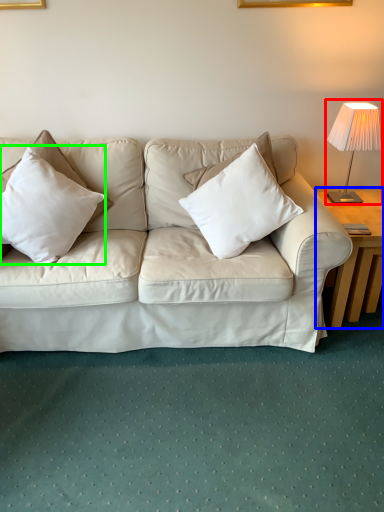
Question: Which object is the farthest from table lamp (highlighted by a red box)? Choose among these: table (highlighted by a blue box) or pillow (highlighted by a green box).

Choices:
 (A) table
 (B) pillow

Answer: (B)